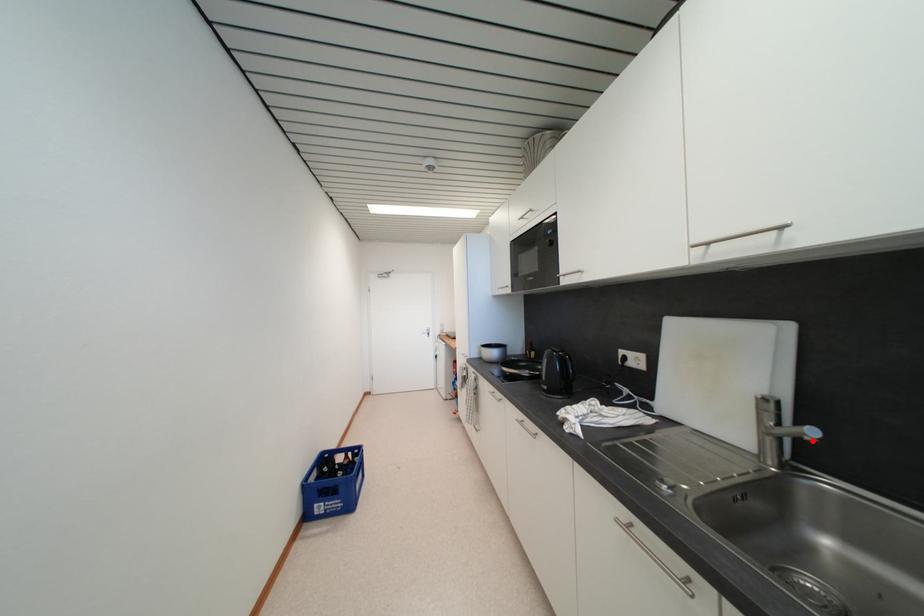
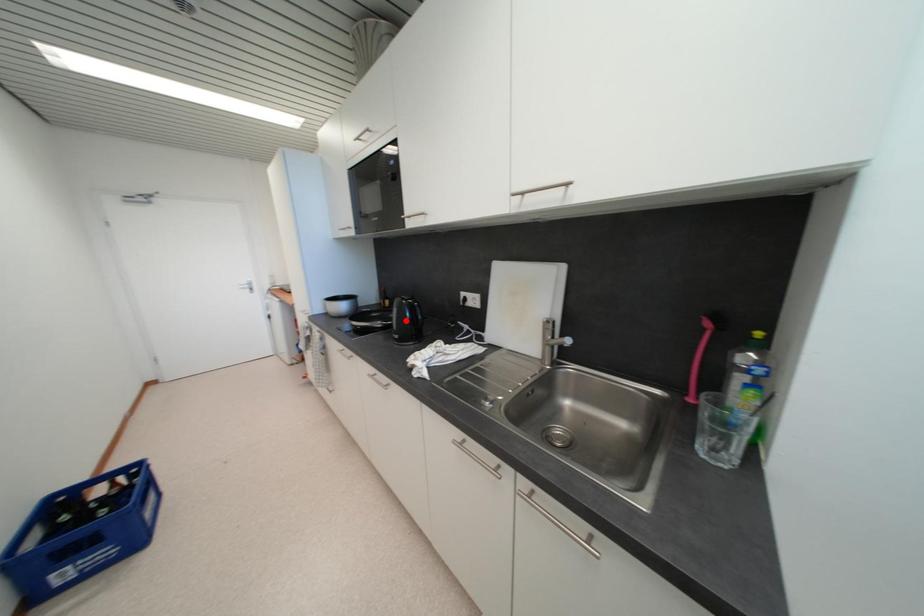
I am providing you with two images of the same scene from different viewpoints. A red point is marked on the first image and another point is marked on the second image. Are the points marked in image1 and image2 representing the same 3D position?

No